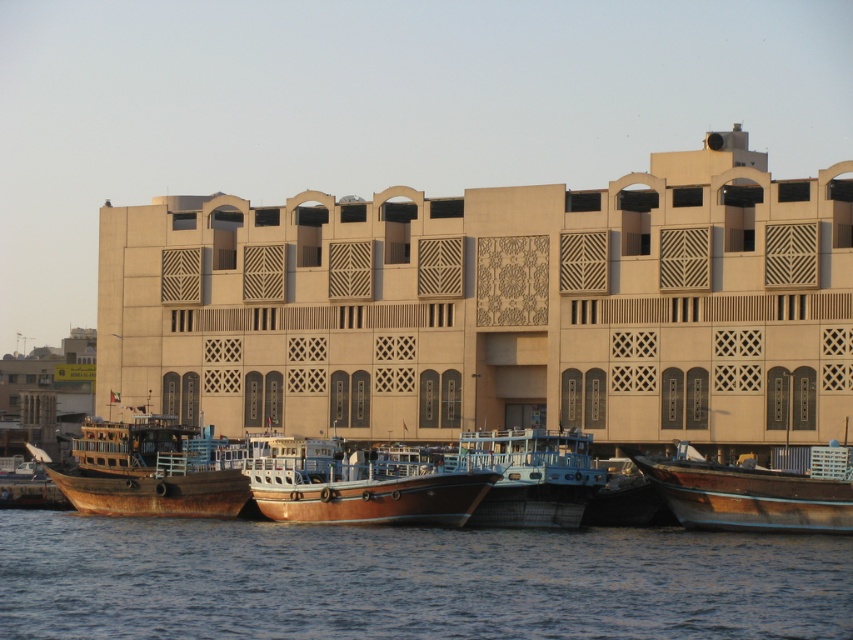
Question: Which point is closer to the camera?

Choices:
 (A) wooden boat at lower left
 (B) blue water at lower center
 (C) wooden boat at right
 (D) rusty wood boat at left

Answer: (B)

Question: Among these objects, which one is nearest to the camera?

Choices:
 (A) wooden boat at right
 (B) wooden blue boat at center
 (C) wooden boat at lower left

Answer: (A)

Question: Is rusty wood boat at left further to the viewer compared to wooden boat at right?

Choices:
 (A) no
 (B) yes

Answer: (B)

Question: Is wooden polished boat at center above rusty wood boat at left?

Choices:
 (A) no
 (B) yes

Answer: (A)

Question: Which point is farther to the camera?

Choices:
 (A) (222, 456)
 (B) (16, 496)
 (C) (300, 470)
 (D) (558, 442)

Answer: (B)

Question: Is wooden boat at right to the left of wooden blue boat at center from the viewer's perspective?

Choices:
 (A) no
 (B) yes

Answer: (A)